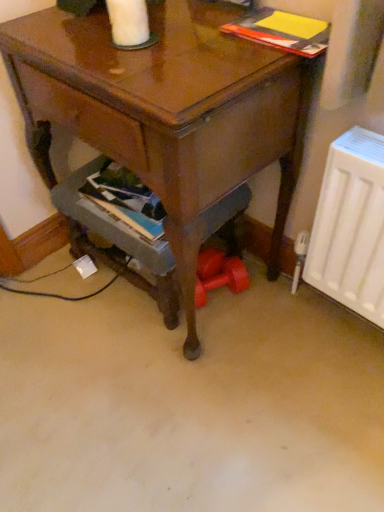
This screenshot has height=512, width=384. What are the coordinates of `shiny brown desk at center` in the screenshot? It's located at (168, 112).

Describe the element at coordinates (168, 112) in the screenshot. I see `shiny brown desk at center` at that location.

What are the coordinates of `shiny brown desk at center` in the screenshot? It's located at (168, 112).